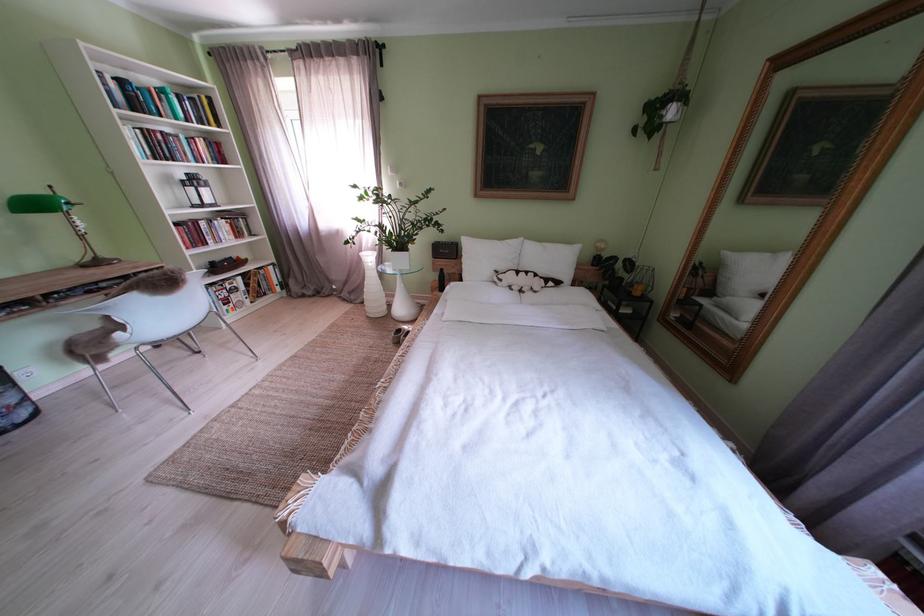
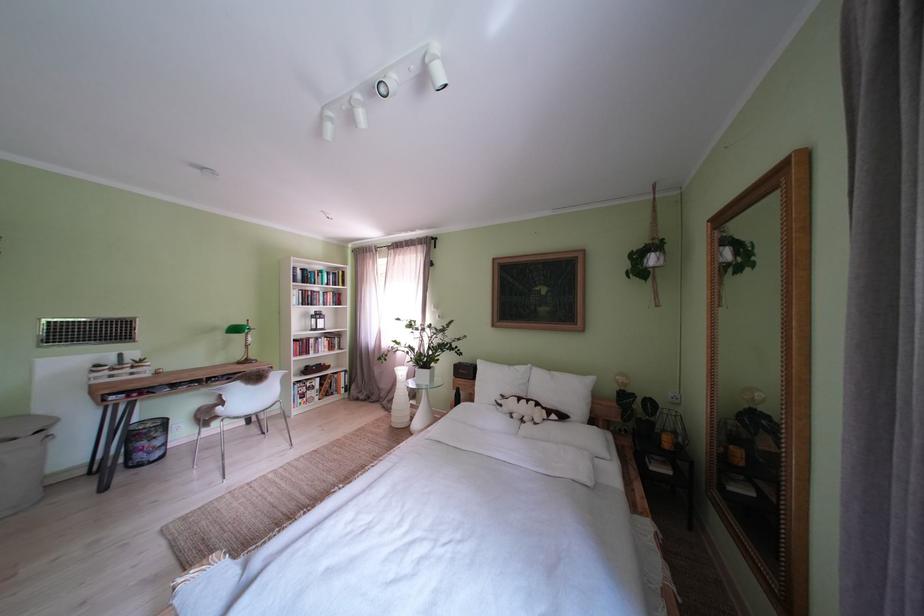
In the second image, find the point that corresponds to [188,230] in the first image.

(307, 346)